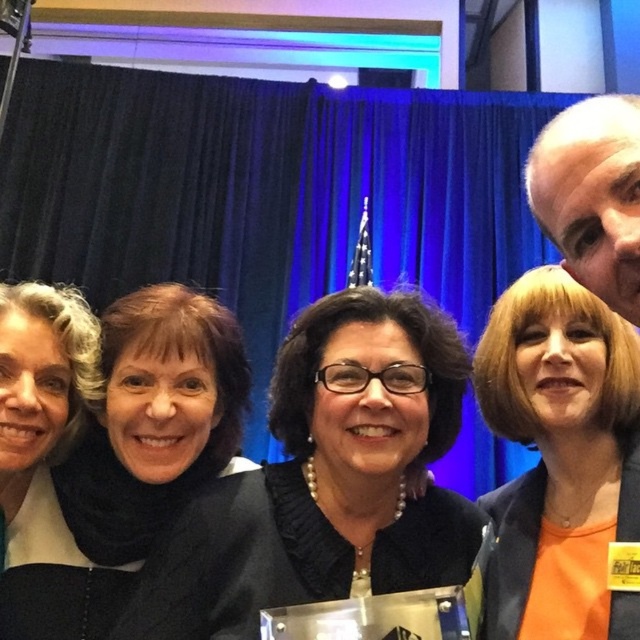
Question: From the image, what is the correct spatial relationship of black pearl necklace at center in relation to matte black jacket at left?

Choices:
 (A) below
 (B) above

Answer: (A)

Question: Does orange matte jacket at upper right appear on the right side of matte black jacket at left?

Choices:
 (A) yes
 (B) no

Answer: (A)

Question: Estimate the real-world distances between objects in this image. Which object is closer to the orange matte jacket at upper right?

Choices:
 (A) black matte scarf at upper left
 (B) black pearl necklace at center
 (C) matte black jacket at left

Answer: (B)

Question: Can you confirm if black pearl necklace at center is positioned below orange matte jacket at upper right?

Choices:
 (A) no
 (B) yes

Answer: (B)

Question: Which is farther from the black pearl necklace at center?

Choices:
 (A) orange matte jacket at upper right
 (B) matte black jacket at left

Answer: (B)

Question: Which is farther from the orange matte jacket at upper right?

Choices:
 (A) black pearl necklace at center
 (B) black matte scarf at upper left

Answer: (B)